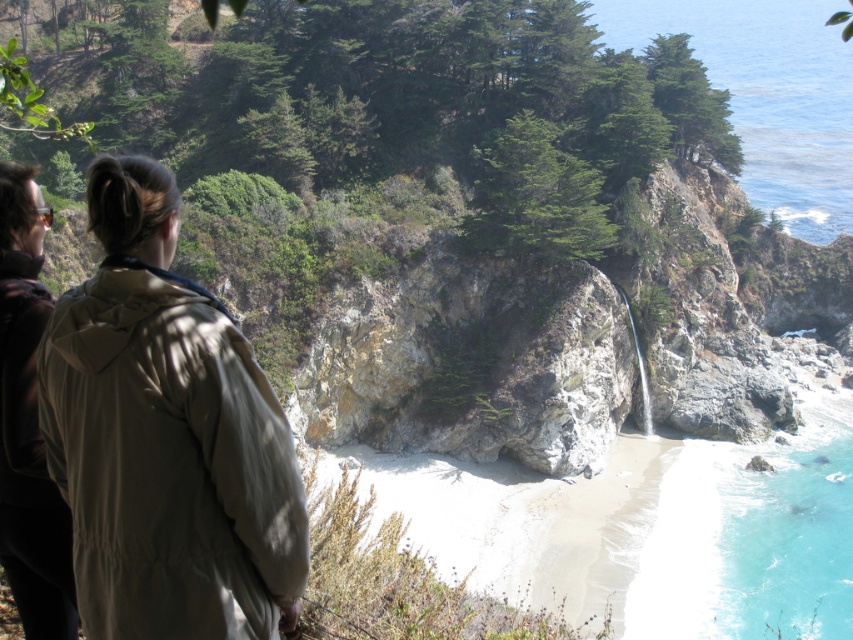
Is turquoise liquid at lower right behind dark brown leather jacket at left?

Yes, turquoise liquid at lower right is behind dark brown leather jacket at left.

Which is behind, point (846, 408) or point (76, 634)?

Point (846, 408)

Image resolution: width=853 pixels, height=640 pixels. I want to click on turquoise liquid at lower right, so click(786, 532).

Does beige fabric jacket at left have a lesser height compared to dark brown leather jacket at left?

Correct, beige fabric jacket at left is not as tall as dark brown leather jacket at left.

Who is lower down, beige fabric jacket at left or dark brown leather jacket at left?

dark brown leather jacket at left is lower down.

Is point (132, 304) closer to camera compared to point (4, 556)?

Yes, point (132, 304) is closer to viewer.

Find the location of a particular element. This screenshot has height=640, width=853. beige fabric jacket at left is located at coordinates (166, 436).

Who is more distant from viewer, (144, 173) or (838, 524)?

The point (838, 524) is more distant.

Is beige fabric jacket at left shorter than turquoise liquid at lower right?

Yes, beige fabric jacket at left is shorter than turquoise liquid at lower right.

Is point (283, 538) less distant than point (759, 560)?

That is True.

Find the location of a particular element. This screenshot has height=640, width=853. beige fabric jacket at left is located at coordinates (166, 436).